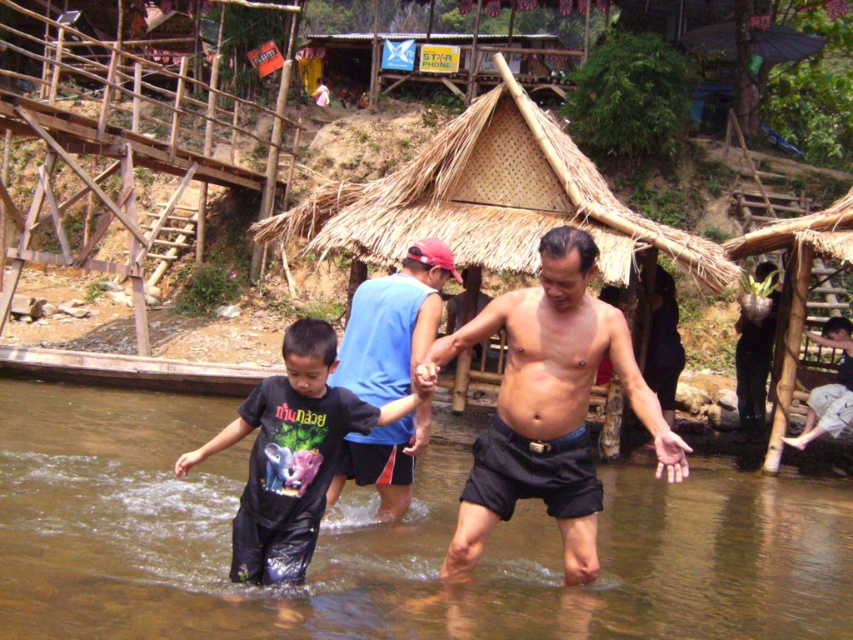
Between matte black shorts at center and dark blue shorts at lower right, which one appears on the right side from the viewer's perspective?

dark blue shorts at lower right is more to the right.

Consider the image. Can you confirm if matte black shorts at center is smaller than dark blue shorts at lower right?

Actually, matte black shorts at center might be larger than dark blue shorts at lower right.

The height and width of the screenshot is (640, 853). Find the location of `matte black shorts at center`. matte black shorts at center is located at coordinates (548, 406).

Where is `matte black shorts at center`? Image resolution: width=853 pixels, height=640 pixels. matte black shorts at center is located at coordinates 548,406.

Is brown muddy stream at center below blue sleeveless shirt at center?

Correct, brown muddy stream at center is located below blue sleeveless shirt at center.

Is brown muddy stream at center taller than blue sleeveless shirt at center?

Incorrect, brown muddy stream at center's height is not larger of blue sleeveless shirt at center's.

The width and height of the screenshot is (853, 640). I want to click on brown muddy stream at center, so click(384, 544).

Is point (650, 432) closer to camera compared to point (408, 268)?

Yes, point (650, 432) is in front of point (408, 268).

Does matte black shorts at center appear under blue sleeveless shirt at center?

Yes, matte black shorts at center is below blue sleeveless shirt at center.

Is point (495, 509) more distant than point (386, 332)?

No, it is in front of (386, 332).

Where is `matte black shorts at center`? matte black shorts at center is located at coordinates (548, 406).